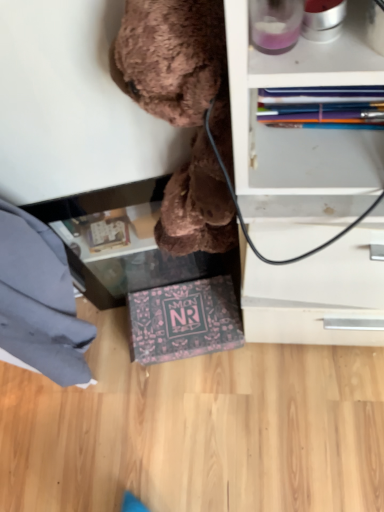
The image size is (384, 512). I want to click on vacant area that is in front of transparent glass table at lower center, so click(x=191, y=390).